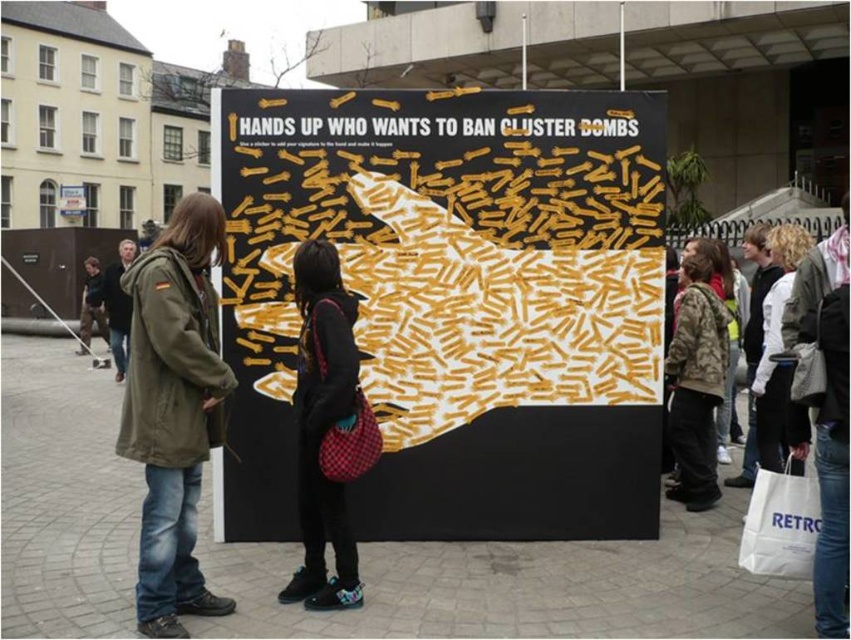
Question: Where is yellow paper cluster bombs at center located in relation to camouflage jacket at center in the image?

Choices:
 (A) below
 (B) above

Answer: (B)

Question: Considering the relative positions of yellow paper cluster bombs at center and olive green parka at center in the image provided, where is yellow paper cluster bombs at center located with respect to olive green parka at center?

Choices:
 (A) right
 (B) left

Answer: (A)

Question: Does yellow paper cluster bombs at center appear under camouflage jacket at center?

Choices:
 (A) no
 (B) yes

Answer: (A)

Question: Which object is the closest to the dark brown leather jacket at center?

Choices:
 (A) olive green parka at center
 (B) camouflage jacket at center

Answer: (A)

Question: Which of the following is the closest to the observer?

Choices:
 (A) dark brown leather jacket at center
 (B) olive green parka at center
 (C) camouflage jacket at center
 (D) yellow paper cluster bombs at center

Answer: (B)

Question: Among these objects, which one is nearest to the camera?

Choices:
 (A) dark brown leather jacket at center
 (B) camouflage jacket at center

Answer: (B)